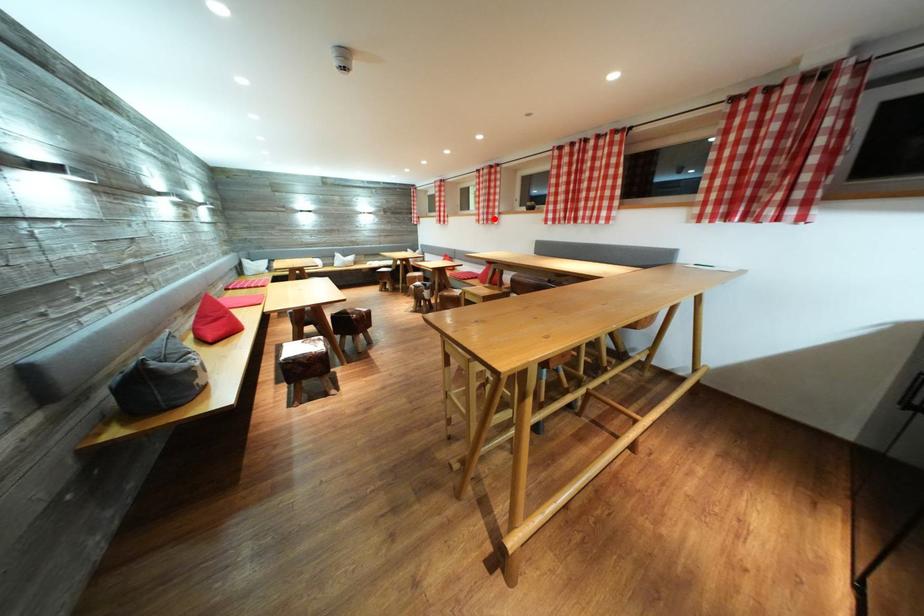
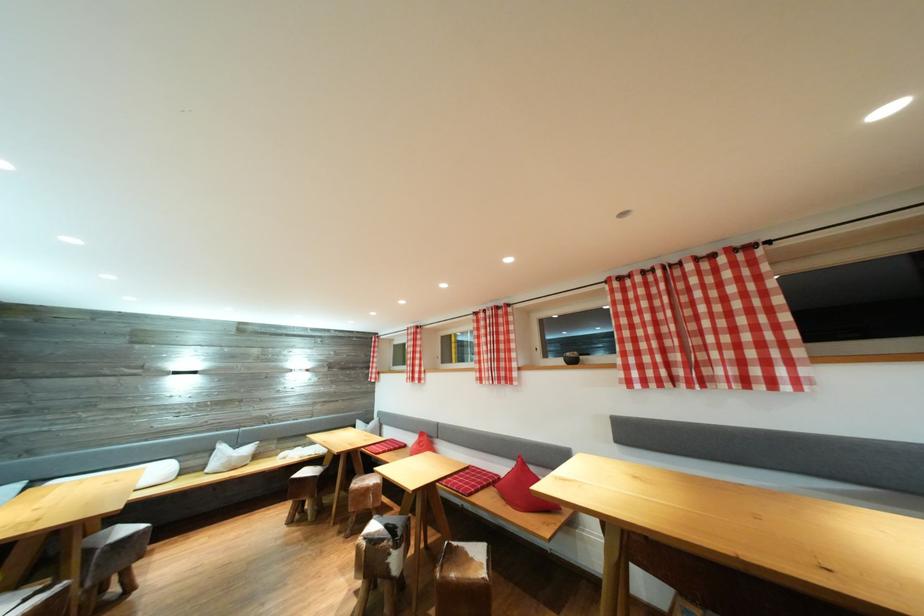
In the second image, find the point that corresponds to the highlighted location in the first image.

(505, 374)